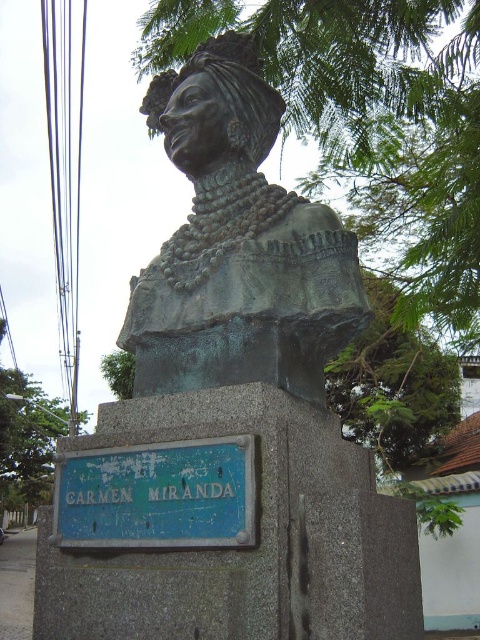
Question: Considering the real-world distances, which object is closest to the blue painted metal sign at lower center?

Choices:
 (A) bronze bust at center
 (B) green leafy tree at left
 (C) green leafy tree at lower left

Answer: (A)

Question: In this image, where is bronze bust at center located relative to green leafy tree at lower left?

Choices:
 (A) left
 (B) right

Answer: (B)

Question: Which is farther from the bronze bust at center?

Choices:
 (A) blue painted metal sign at lower center
 (B) green leafy tree at lower left
 (C) green leafy tree at left

Answer: (C)

Question: Is green leafy tree at left to the left of green leafy tree at lower left from the viewer's perspective?

Choices:
 (A) no
 (B) yes

Answer: (B)

Question: In this image, where is bronze bust at center located relative to green leafy tree at left?

Choices:
 (A) right
 (B) left

Answer: (A)

Question: Which of the following is the farthest from the observer?

Choices:
 (A) green leafy tree at left
 (B) bronze bust at center
 (C) green leafy tree at lower left
 (D) blue painted metal sign at lower center

Answer: (A)